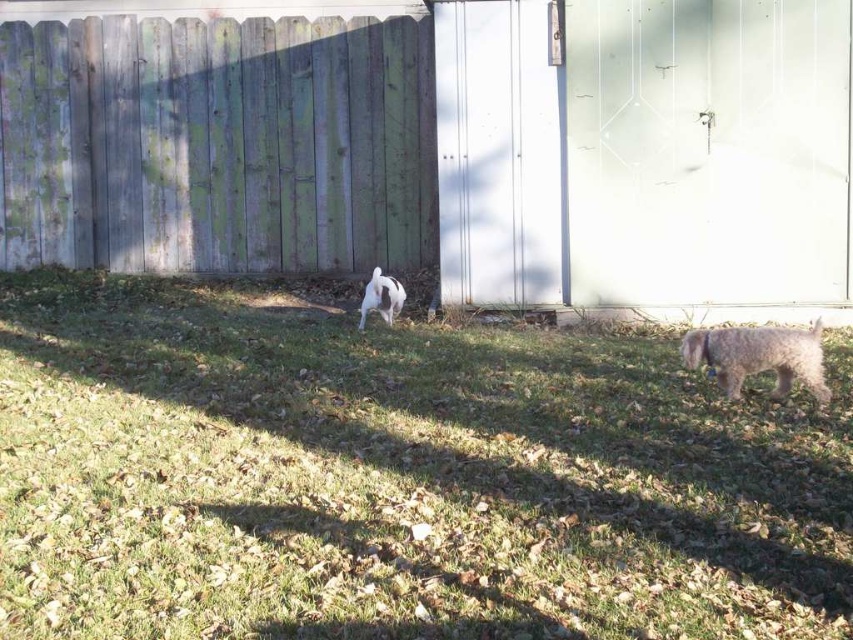
Question: Does fuzzy gray dog at lower right have a lesser width compared to white fur dog at center?

Choices:
 (A) yes
 (B) no

Answer: (B)

Question: Does weathered wood fence at upper left have a greater width compared to fuzzy gray dog at lower right?

Choices:
 (A) yes
 (B) no

Answer: (A)

Question: Where is weathered wood fence at upper left located in relation to white fur dog at center in the image?

Choices:
 (A) below
 (B) above

Answer: (B)

Question: Which of the following is the farthest from the observer?

Choices:
 (A) click(x=189, y=42)
 (B) click(x=373, y=276)

Answer: (B)

Question: Which point is closer to the camera?

Choices:
 (A) white fur dog at center
 (B) fuzzy gray dog at lower right

Answer: (B)

Question: Estimate the real-world distances between objects in this image. Which object is farther from the white fur dog at center?

Choices:
 (A) fuzzy gray dog at lower right
 (B) weathered wood fence at upper left

Answer: (A)